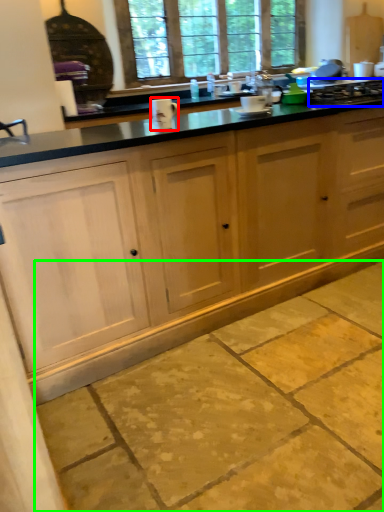
Question: Based on their relative distances, which object is farther from appliance (highlighted by a red box)? Choose from gas stove (highlighted by a blue box) and concrete (highlighted by a green box).

Choices:
 (A) gas stove
 (B) concrete

Answer: (A)